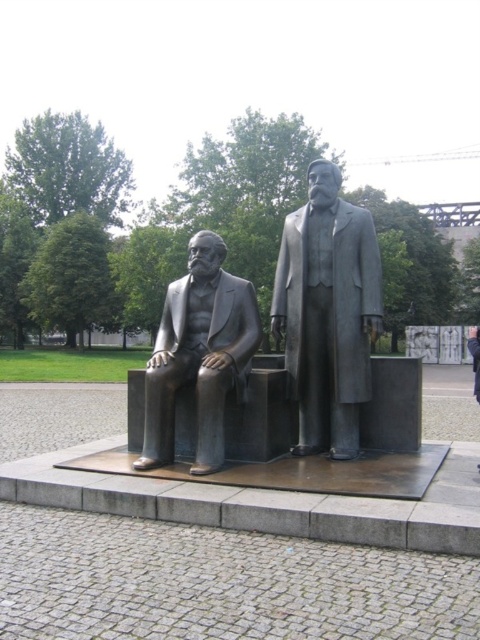
Question: Which point is farther to the camera?

Choices:
 (A) polished bronze statue at center
 (B) bronze statue at left

Answer: (A)

Question: Which of the following is the closest to the observer?

Choices:
 (A) (333, 236)
 (B) (471, 326)
 (C) (208, 332)

Answer: (C)

Question: Can you confirm if bronze statue at left is bigger than bronze statue at center?

Choices:
 (A) yes
 (B) no

Answer: (B)

Question: Is polished bronze statue at center bigger than bronze statue at left?

Choices:
 (A) no
 (B) yes

Answer: (A)

Question: Which of the following is the closest to the observer?

Choices:
 (A) bronze statue at center
 (B) polished bronze statue at center

Answer: (A)

Question: In this image, where is bronze statue at left located relative to bronze statue at center?

Choices:
 (A) below
 (B) above

Answer: (B)